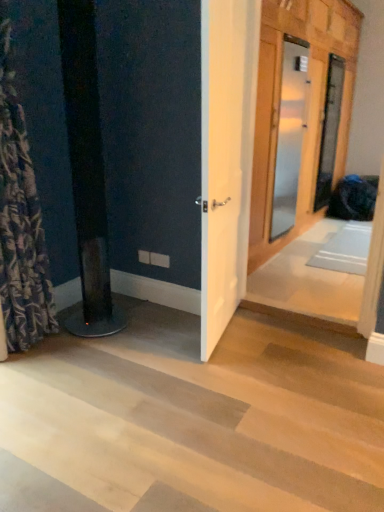
Locate an element on the screen. vacant space to the right of black glossy speaker at left is located at coordinates (143, 330).